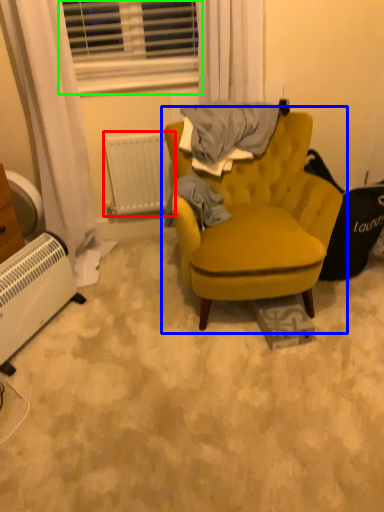
Question: Which is nearer to the radiator (highlighted by a red box)? chair (highlighted by a blue box) or window (highlighted by a green box).

Choices:
 (A) chair
 (B) window

Answer: (B)